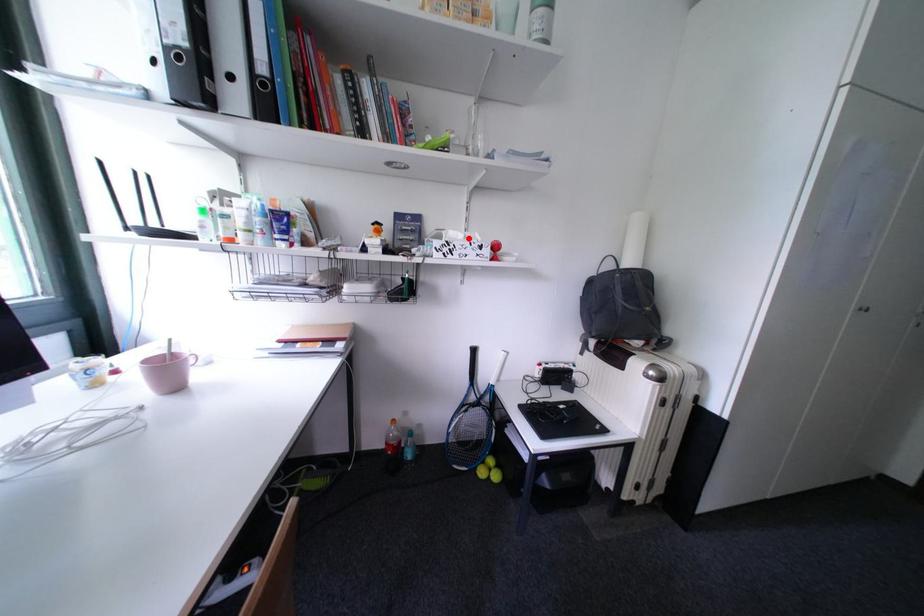
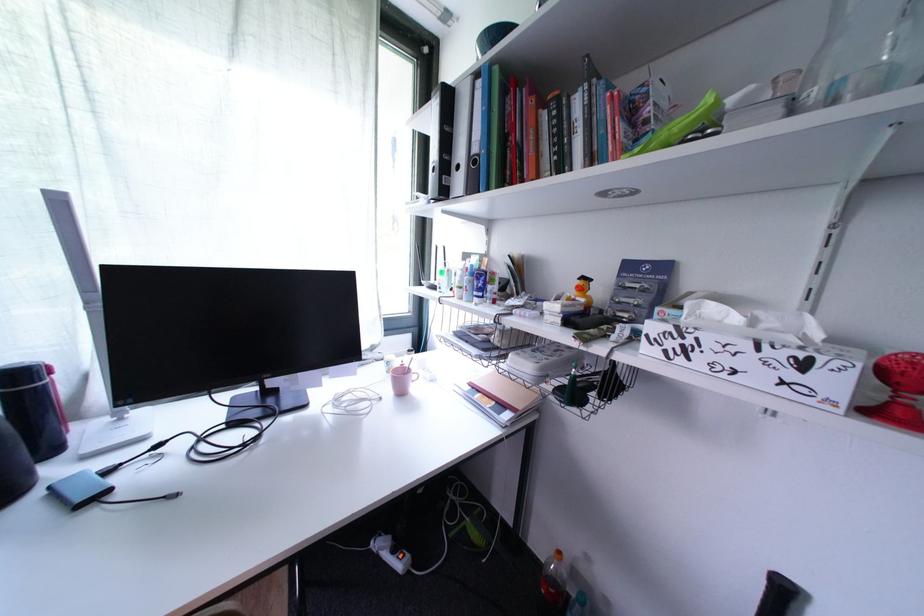
Find the pixel in the second image that matches the highlighted location in the first image.

(745, 321)